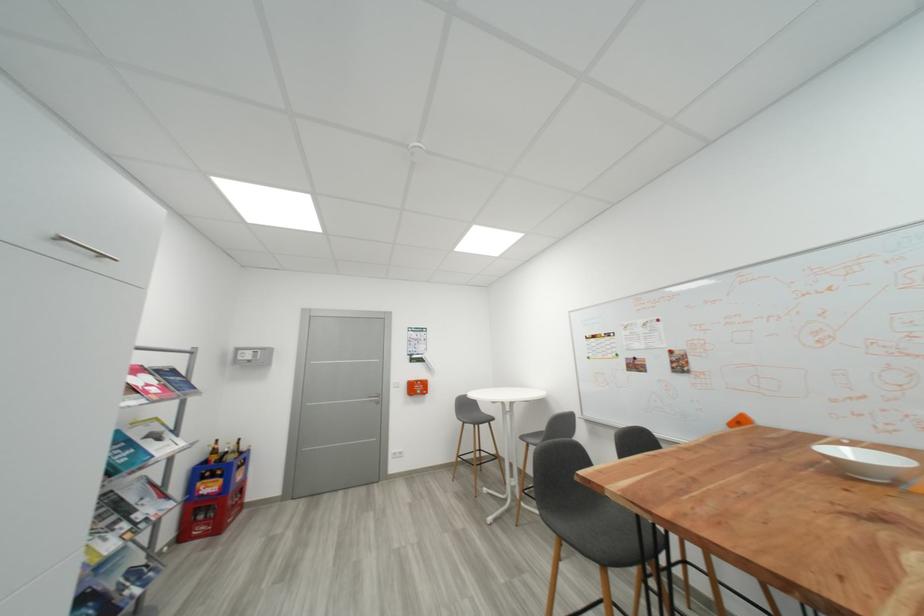
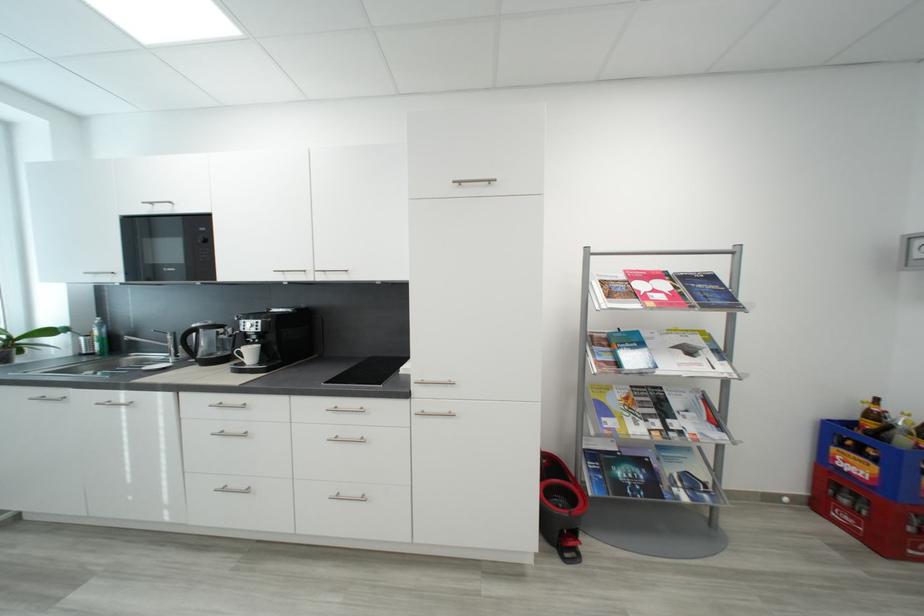
Find the pixel in the second image that matches [220,477] in the first image.

(867, 454)